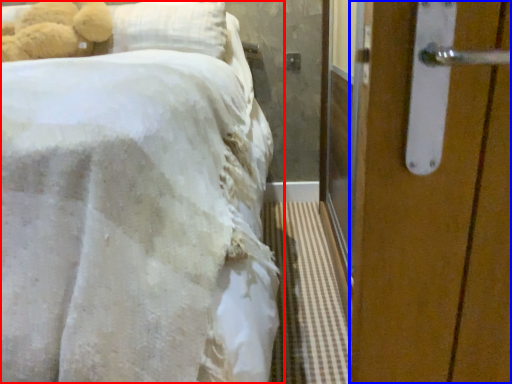
Question: Which of the following is the farthest to the observer, bed (highlighted by a red box) or door (highlighted by a blue box)?

Choices:
 (A) bed
 (B) door

Answer: (B)